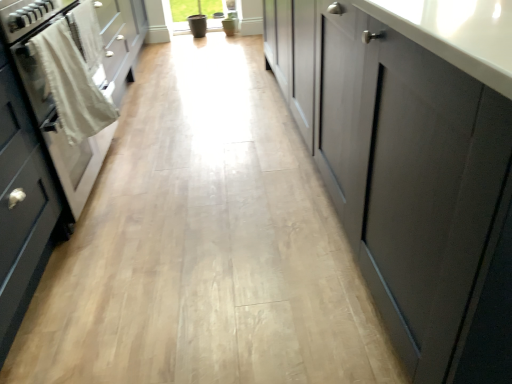
This screenshot has height=384, width=512. What do you see at coordinates (71, 84) in the screenshot? I see `white cotton towel at left` at bounding box center [71, 84].

What do you see at coordinates (398, 164) in the screenshot?
I see `matte gray cabinet at center, the 1th cabinetry in the right-to-left sequence` at bounding box center [398, 164].

Measure the distance between matte gray cabinet at center, the second cabinetry from the left, and camera.

They are 51.96 centimeters apart.

At what (x,y) coordinates should I click in order to perform the action: click on white cotton towel at left. Please return your answer as a coordinate pair (x, y). The width and height of the screenshot is (512, 384). Looking at the image, I should click on (71, 84).

Is the depth of white cotton towel at left less than that of matte gray cabinet at center, the second cabinetry from the left?

No, white cotton towel at left is behind matte gray cabinet at center, the second cabinetry from the left.

The image size is (512, 384). What are the coordinates of `laundry above the matte gray cabinet at center, the second cabinetry from the left (from a real-world perspective)` in the screenshot? It's located at (71, 84).

Who is taller, white cotton towel at left or matte gray cabinet at center, the 1th cabinetry in the right-to-left sequence?

matte gray cabinet at center, the 1th cabinetry in the right-to-left sequence, is taller.

How different are the orientations of white cotton towel at left and matte gray cabinet at center, the second cabinetry from the left, in degrees?

The angle between the facing direction of white cotton towel at left and the facing direction of matte gray cabinet at center, the second cabinetry from the left, is 0.611 degrees.

Is matte gray cabinet at center, the 1th cabinetry in the right-to-left sequence, to the left or to the right of white glossy oven at left in the image?

matte gray cabinet at center, the 1th cabinetry in the right-to-left sequence, is positioned on white glossy oven at left's right side.

Is matte gray cabinet at center, the second cabinetry from the left, far away from white glossy oven at left?

Yes, matte gray cabinet at center, the second cabinetry from the left, and white glossy oven at left are quite far apart.

Considering the relative sizes of matte gray cabinet at center, the 1th cabinetry in the right-to-left sequence, and white glossy oven at left in the image provided, is matte gray cabinet at center, the 1th cabinetry in the right-to-left sequence, smaller than white glossy oven at left?

Actually, matte gray cabinet at center, the 1th cabinetry in the right-to-left sequence, might be larger than white glossy oven at left.

Considering the relative sizes of matte gray cabinet at center, the second cabinetry from the left, and matte gray cabinet at left, the 1th cabinetry when ordered from left to right, in the image provided, is matte gray cabinet at center, the second cabinetry from the left, smaller than matte gray cabinet at left, the 1th cabinetry when ordered from left to right,?

No.

Considering the sizes of matte gray cabinet at center, the second cabinetry from the left, and matte gray cabinet at left, the 1th cabinetry when ordered from left to right, in the image, is matte gray cabinet at center, the second cabinetry from the left, taller or shorter than matte gray cabinet at left, the 1th cabinetry when ordered from left to right,?

Clearly, matte gray cabinet at center, the second cabinetry from the left, is taller compared to matte gray cabinet at left, the 1th cabinetry when ordered from left to right.

Are matte gray cabinet at left, which is the 2th cabinetry in right-to-left order, and white glossy oven at left located far from each other?

Actually, matte gray cabinet at left, which is the 2th cabinetry in right-to-left order, and white glossy oven at left are a little close together.

Can you confirm if matte gray cabinet at left, which is the 2th cabinetry in right-to-left order, is positioned to the left of white glossy oven at left?

No, matte gray cabinet at left, which is the 2th cabinetry in right-to-left order, is not to the left of white glossy oven at left.

Where is `oven lying behind the matte gray cabinet at left, the 1th cabinetry when ordered from left to right`? The image size is (512, 384). oven lying behind the matte gray cabinet at left, the 1th cabinetry when ordered from left to right is located at coordinates (x=51, y=92).

Can you confirm if matte gray cabinet at left, the 1th cabinetry when ordered from left to right, is smaller than white glossy oven at left?

Yes.

Between matte gray cabinet at left, the 1th cabinetry when ordered from left to right, and white cotton towel at left, which one is positioned in front?

Positioned in front is matte gray cabinet at left, the 1th cabinetry when ordered from left to right.

How many degrees apart are the facing directions of matte gray cabinet at left, which is the 2th cabinetry in right-to-left order, and white cotton towel at left?

The facing directions of matte gray cabinet at left, which is the 2th cabinetry in right-to-left order, and white cotton towel at left are 0.725 degrees apart.

Is matte gray cabinet at left, the 1th cabinetry when ordered from left to right, facing away from white cotton towel at left?

No.

Does point (81, 173) come closer to viewer compared to point (86, 104)?

That is False.

Which point is more forward, (29, 45) or (97, 146)?

The point (29, 45) is in front.

Can you confirm if white cotton towel at left is wider than white glossy oven at left?

No, white cotton towel at left is not wider than white glossy oven at left.

Does white cotton towel at left touch white glossy oven at left?

Yes, white cotton towel at left is beside white glossy oven at left.

This screenshot has width=512, height=384. Identify the location of laundry above the white glossy oven at left (from a real-world perspective). (x=71, y=84).

Would you consider white cotton towel at left to be distant from matte gray cabinet at left, which is the 2th cabinetry in right-to-left order?

No.

Considering the relative sizes of white cotton towel at left and matte gray cabinet at left, which is the 2th cabinetry in right-to-left order, in the image provided, is white cotton towel at left thinner than matte gray cabinet at left, which is the 2th cabinetry in right-to-left order,?

Yes, white cotton towel at left is thinner than matte gray cabinet at left, which is the 2th cabinetry in right-to-left order.

Is point (93, 85) positioned in front of point (76, 187)?

Yes, it is.

Which cabinetry is the 2nd one when counting from the front of the white cotton towel at left? Please provide its 2D coordinates.

[(398, 164)]

The image size is (512, 384). I want to click on the 2nd cabinetry counting from the right of the white glossy oven at left, so click(398, 164).

Estimate the real-world distances between objects in this image. Which object is closer to white cotton towel at left, white glossy oven at left or matte gray cabinet at center, the second cabinetry from the left?

white glossy oven at left lies closer to white cotton towel at left than the other object.

Estimate the real-world distances between objects in this image. Which object is closer to white cotton towel at left, white glossy oven at left or matte gray cabinet at left, the 1th cabinetry when ordered from left to right?

The object closer to white cotton towel at left is white glossy oven at left.

From the image, which object appears to be nearer to white glossy oven at left, matte gray cabinet at left, the 1th cabinetry when ordered from left to right, or white cotton towel at left?

white cotton towel at left.

Considering their positions, is white glossy oven at left positioned closer to matte gray cabinet at left, the 1th cabinetry when ordered from left to right, than matte gray cabinet at center, the second cabinetry from the left?

Among the two, white glossy oven at left is located nearer to matte gray cabinet at left, the 1th cabinetry when ordered from left to right.

Estimate the real-world distances between objects in this image. Which object is further from matte gray cabinet at center, the 1th cabinetry in the right-to-left sequence, white cotton towel at left or matte gray cabinet at left, which is the 2th cabinetry in right-to-left order?

matte gray cabinet at left, which is the 2th cabinetry in right-to-left order, is positioned further to the anchor matte gray cabinet at center, the 1th cabinetry in the right-to-left sequence.

Considering their positions, is white cotton towel at left positioned closer to matte gray cabinet at left, the 1th cabinetry when ordered from left to right, than white glossy oven at left?

white glossy oven at left is closer to matte gray cabinet at left, the 1th cabinetry when ordered from left to right.

Based on the photo, considering their positions, is matte gray cabinet at left, which is the 2th cabinetry in right-to-left order, positioned closer to white cotton towel at left than white glossy oven at left?

white glossy oven at left.

Estimate the real-world distances between objects in this image. Which object is further from matte gray cabinet at center, the second cabinetry from the left, white glossy oven at left or white cotton towel at left?

The object further to matte gray cabinet at center, the second cabinetry from the left, is white glossy oven at left.

At what (x,y) coordinates should I click in order to perform the action: click on laundry between matte gray cabinet at left, the 1th cabinetry when ordered from left to right, and matte gray cabinet at center, the second cabinetry from the left. Please return your answer as a coordinate pair (x, y). Image resolution: width=512 pixels, height=384 pixels. Looking at the image, I should click on (71, 84).

You are a GUI agent. You are given a task and a screenshot of the screen. Output one action in this format:
    pyautogui.click(x=<x>, y=<y>)
    Task: Click on the cabinetry between white glossy oven at left and matte gray cabinet at center, the 1th cabinetry in the right-to-left sequence, in the horizontal direction
    This screenshot has width=512, height=384.
    Given the screenshot: What is the action you would take?
    [x=51, y=136]

Find the location of a particular element. This screenshot has width=512, height=384. laundry between white glossy oven at left and matte gray cabinet at center, the second cabinetry from the left is located at coordinates (71, 84).

This screenshot has width=512, height=384. I want to click on oven located between matte gray cabinet at left, the 1th cabinetry when ordered from left to right, and white cotton towel at left in the depth direction, so point(51,92).